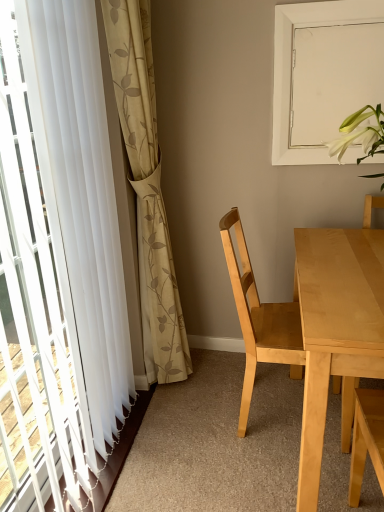
Question: Can you confirm if white sheer curtain at left, the 1th curtain in the left-to-right sequence, is smaller than light wood table at right?

Choices:
 (A) yes
 (B) no

Answer: (A)

Question: Is white sheer curtain at left, the second curtain from the right, far from light wood table at right?

Choices:
 (A) yes
 (B) no

Answer: (B)

Question: Is white sheer curtain at left, the 1th curtain in the left-to-right sequence, closer to camera compared to light wood table at right?

Choices:
 (A) yes
 (B) no

Answer: (A)

Question: Is white sheer curtain at left, the 1th curtain in the left-to-right sequence, facing away from light wood table at right?

Choices:
 (A) no
 (B) yes

Answer: (A)

Question: Considering the relative sizes of white sheer curtain at left, the 1th curtain in the left-to-right sequence, and light wood table at right in the image provided, is white sheer curtain at left, the 1th curtain in the left-to-right sequence, taller than light wood table at right?

Choices:
 (A) no
 (B) yes

Answer: (B)

Question: Does white sheer curtain at left, the 1th curtain in the left-to-right sequence, touch light wood table at right?

Choices:
 (A) no
 (B) yes

Answer: (A)

Question: From the image's perspective, is white sheer curtain at left, the second curtain from the right, over light wood chair at center?

Choices:
 (A) no
 (B) yes

Answer: (B)

Question: Is white sheer curtain at left, the 1th curtain in the left-to-right sequence, located outside light wood chair at center?

Choices:
 (A) yes
 (B) no

Answer: (A)

Question: Considering the relative sizes of white sheer curtain at left, the second curtain from the right, and light wood chair at center in the image provided, is white sheer curtain at left, the second curtain from the right, shorter than light wood chair at center?

Choices:
 (A) no
 (B) yes

Answer: (A)

Question: Would you consider white sheer curtain at left, the 1th curtain in the left-to-right sequence, to be distant from light wood chair at center?

Choices:
 (A) no
 (B) yes

Answer: (A)

Question: Considering the relative sizes of white sheer curtain at left, the 1th curtain in the left-to-right sequence, and light wood chair at center in the image provided, is white sheer curtain at left, the 1th curtain in the left-to-right sequence, smaller than light wood chair at center?

Choices:
 (A) yes
 (B) no

Answer: (B)

Question: Is white sheer curtain at left, the second curtain from the right, touching light wood chair at center?

Choices:
 (A) no
 (B) yes

Answer: (A)

Question: Are light wood table at right and white matte window screen at upper right beside each other?

Choices:
 (A) yes
 (B) no

Answer: (B)